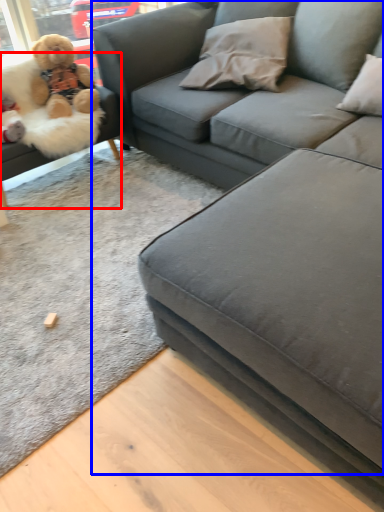
Question: Which object appears farthest to the camera in this image, studio couch (highlighted by a red box) or studio couch (highlighted by a blue box)?

Choices:
 (A) studio couch
 (B) studio couch

Answer: (A)